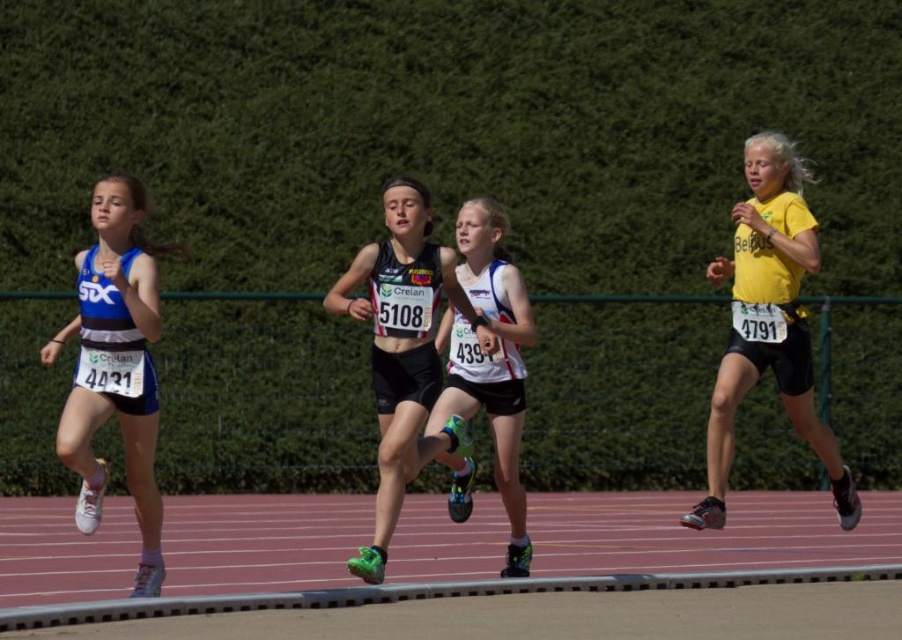
You are a photographer trying to capture a closeup of the yellow matte shirt at right and the white matte tank top at center. Given that your camera can only focus on objects within a 1.5 meter width, will both shirts fit within the frame?

The yellow matte shirt at right is wider than the white matte tank top at center. However, the camera can only focus on objects within a 1.5 meter width. Since the description does not provide the exact width of either shirt, it is impossible to determine if both will fit within the frame.

You are a photographer trying to capture a closeup of the yellow matte shirt at right. Where should you position your camera to get the best shot?

To capture a closeup of the yellow matte shirt at right, position your camera near the coordinates point [769,323] where the yellow matte shirt at right is located.

You are a photographer at a track event. You need to capture a photo that includes both the yellow matte shirt at right and the black matte running shoe at center. Based on their positions, which object should appear on the left side of the photo?

The black matte running shoe at center should appear on the left side of the photo because the yellow matte shirt at right is positioned to the right of it.